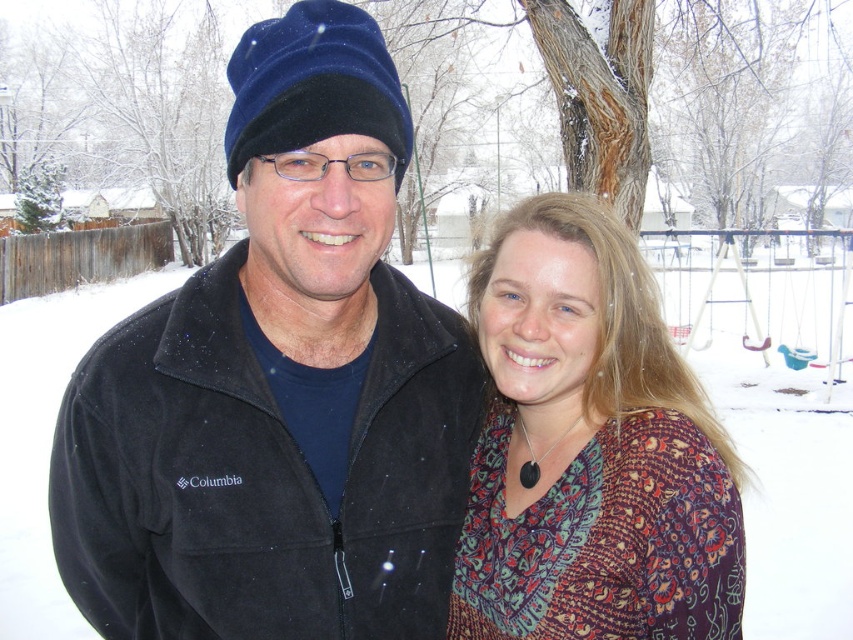
Does suede jacket at center appear on the right side of patterned fabric blouse at center?

No, suede jacket at center is not to the right of patterned fabric blouse at center.

Does point (260, 268) come closer to viewer compared to point (637, 278)?

Yes, it is in front of point (637, 278).

You are a GUI agent. You are given a task and a screenshot of the screen. Output one action in this format:
    pyautogui.click(x=<x>, y=<y>)
    Task: Click on the suede jacket at center
    The width and height of the screenshot is (853, 640).
    Given the screenshot: What is the action you would take?
    pyautogui.click(x=277, y=387)

Is point (428, 333) positioned before point (695, 371)?

Yes.

Between suede jacket at center and white fluffy snow at center, which one is positioned higher?

white fluffy snow at center is higher up.

The height and width of the screenshot is (640, 853). Find the location of `suede jacket at center`. suede jacket at center is located at coordinates (277, 387).

Based on the photo, can you confirm if patterned fabric blouse at center is positioned above white fluffy snow at center?

Actually, patterned fabric blouse at center is below white fluffy snow at center.

Is patterned fabric blouse at center to the left of white fluffy snow at center from the viewer's perspective?

In fact, patterned fabric blouse at center is to the right of white fluffy snow at center.

Describe the element at coordinates (590, 449) in the screenshot. I see `patterned fabric blouse at center` at that location.

Find the location of a particular element. This screenshot has height=640, width=853. patterned fabric blouse at center is located at coordinates (590, 449).